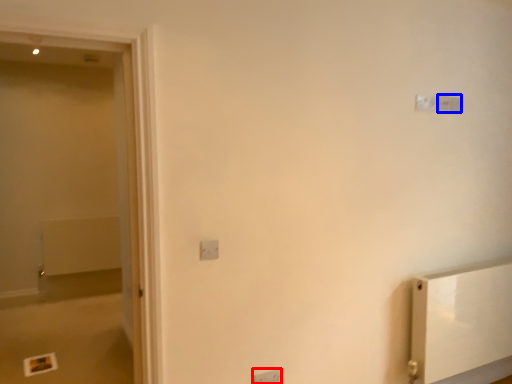
Question: Among these objects, which one is farthest to the camera, light switch (highlighted by a red box) or light switch (highlighted by a blue box)?

Choices:
 (A) light switch
 (B) light switch

Answer: (B)